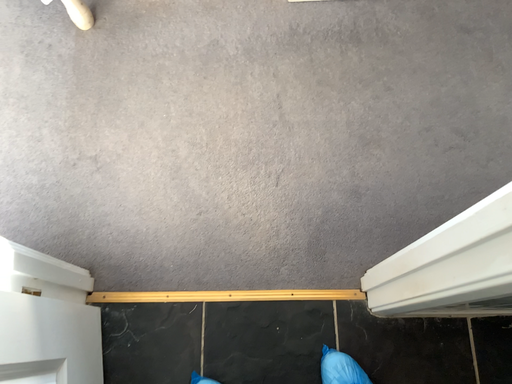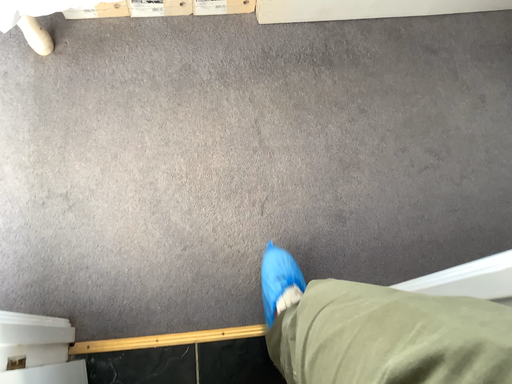
Question: How did the camera likely rotate when shooting the video?

Choices:
 (A) rotated left
 (B) rotated right

Answer: (B)